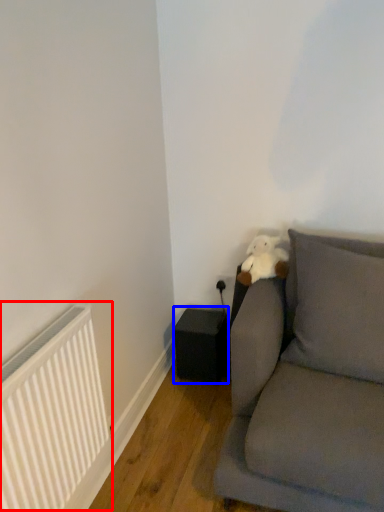
Question: Which point is further to the camera, radiator (highlighted by a red box) or speaker (highlighted by a blue box)?

Choices:
 (A) radiator
 (B) speaker

Answer: (B)